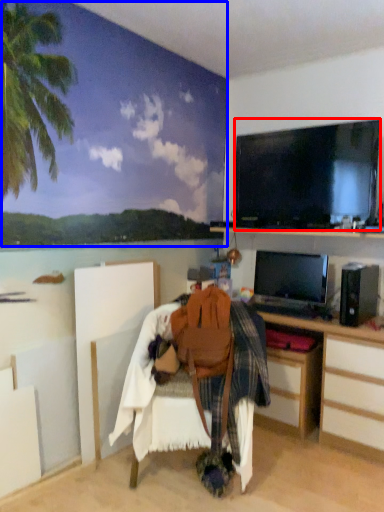
Question: Which of the following is the closest to the observer, television (highlighted by a red box) or backdrop (highlighted by a blue box)?

Choices:
 (A) television
 (B) backdrop

Answer: (B)